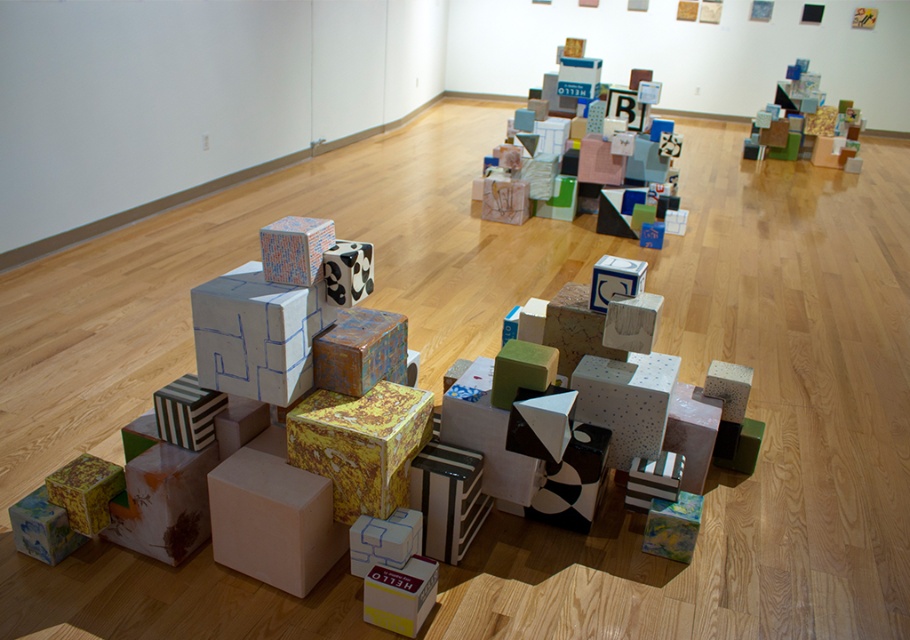
You are an artist trying to place a new sculpture on top of the yellow textured cardboard box at center. However, you notice the textured multicolored cube at center is already there. Can you still place your sculpture on the box without moving the cube?

The yellow textured cardboard box at center is below the textured multicolored cube at center, meaning the cube is already resting on the box. Therefore, you cannot place your sculpture on the box without first removing the cube.

You are an artist trying to place a new sculpture on the floor. You have a 1.2 meter wide sculpture. The textured multicolored cube at center and the yellow textured cube at lower left are already in place. Can you fit your sculpture between them without moving any existing objects?

The textured multicolored cube at center might be wider than yellow textured cube at lower left, so it is uncertain whether there is enough space between them to fit a 1.2 meter wide sculpture. You should measure the distance between them first.